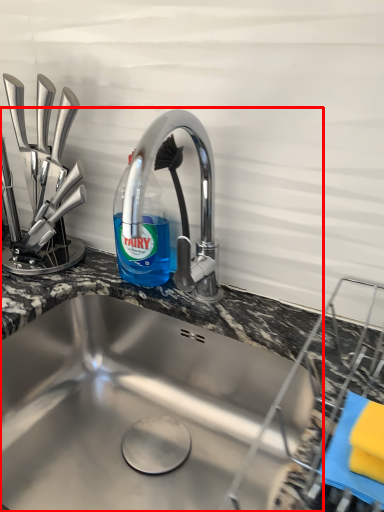
Question: From the image's perspective, considering the relative positions of sink (annotated by the red box) and bottle in the image provided, where is sink (annotated by the red box) located with respect to the staircase?

Choices:
 (A) above
 (B) below

Answer: (B)